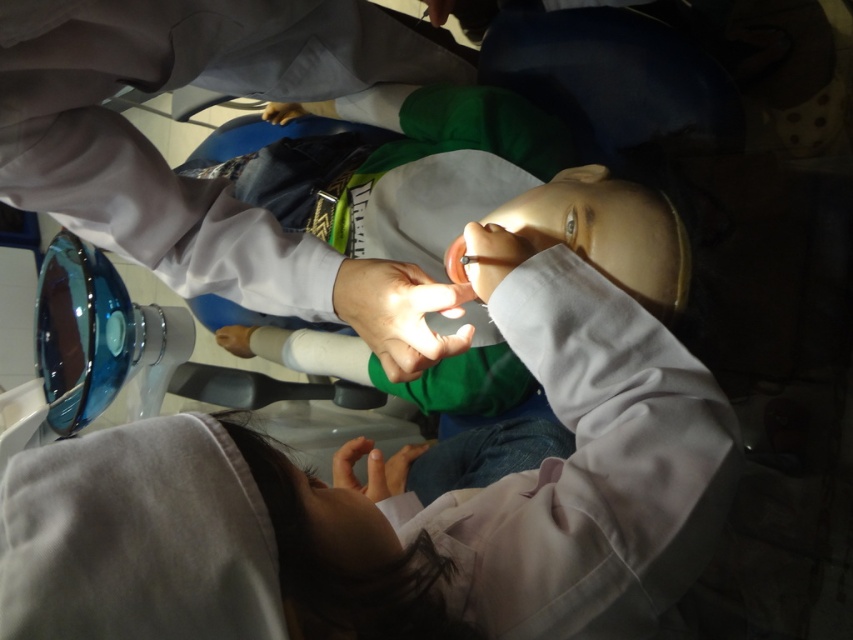
You are a GUI agent. You are given a task and a screenshot of the screen. Output one action in this format:
    pyautogui.click(x=<x>, y=<y>)
    Task: Click on the matte white hand at center
    The height and width of the screenshot is (640, 853).
    Given the screenshot: What is the action you would take?
    pos(235,339)

Which is behind, point (236, 349) or point (285, 108)?

Point (236, 349)

Is point (225, 340) farther from viewer compared to point (265, 106)?

No, (225, 340) is in front of (265, 106).

The width and height of the screenshot is (853, 640). What are the coordinates of `matte white hand at center` in the screenshot? It's located at (235, 339).

Is point (418, 360) closer to viewer compared to point (283, 113)?

Yes, it is.

Which is behind, point (370, 289) or point (271, 113)?

The point (271, 113) is more distant.

What are the coordinates of `smooth skin hand at center` in the screenshot? It's located at point(399,314).

Between smooth skin hand at center and matte white hand at center, which one has more height?

smooth skin hand at center

Is point (358, 326) positioned behind point (242, 333)?

No.

The height and width of the screenshot is (640, 853). What do you see at coordinates (399, 314) in the screenshot? I see `smooth skin hand at center` at bounding box center [399, 314].

At what (x,y) coordinates should I click in order to perform the action: click on smooth skin hand at center. Please return your answer as a coordinate pair (x, y). This screenshot has width=853, height=640. Looking at the image, I should click on (399, 314).